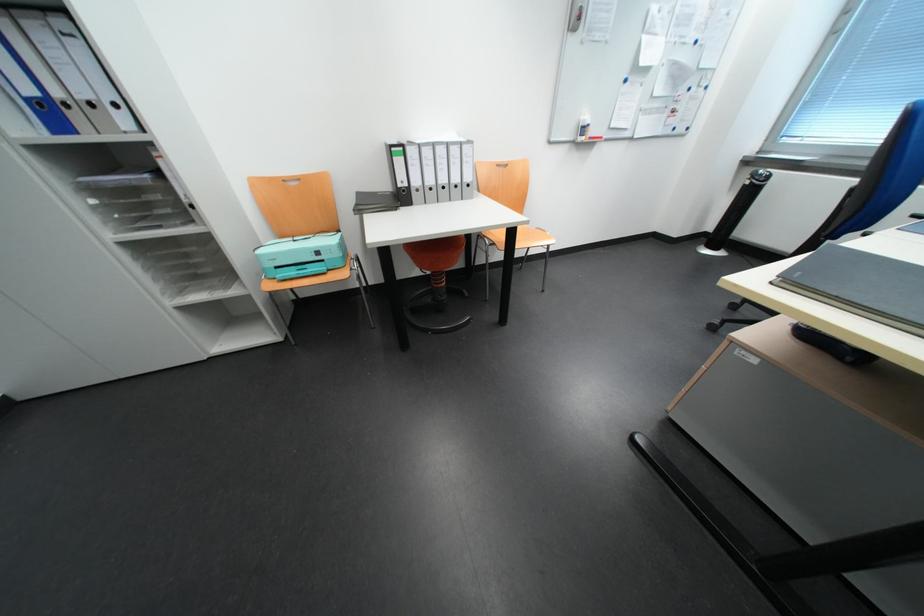
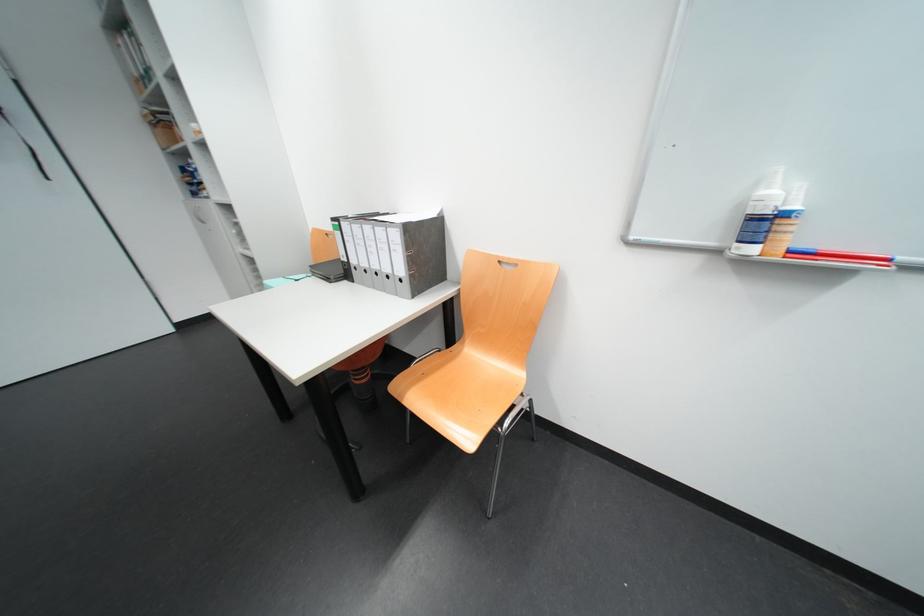
Find the pixel in the second image that matches the point at 593,120 in the first image.

(773, 193)